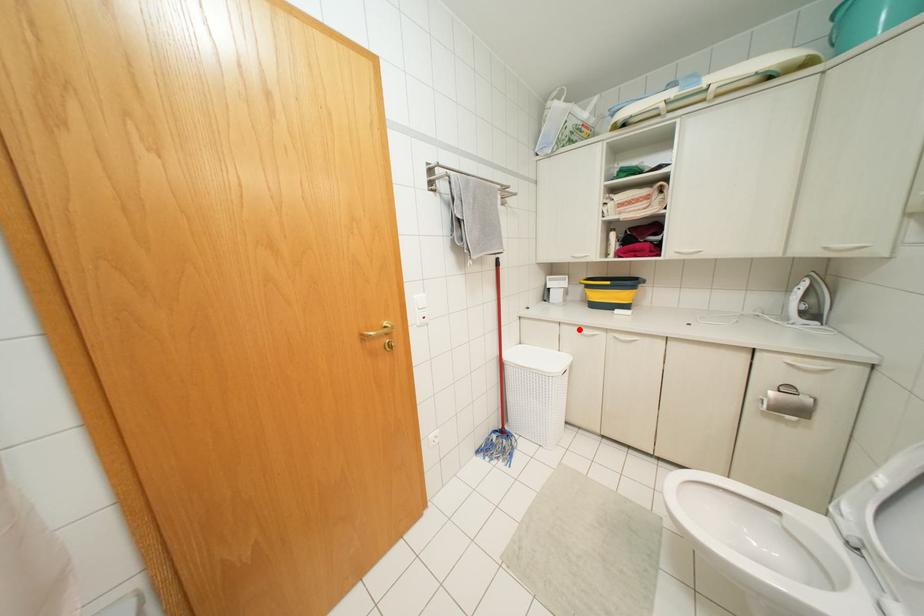
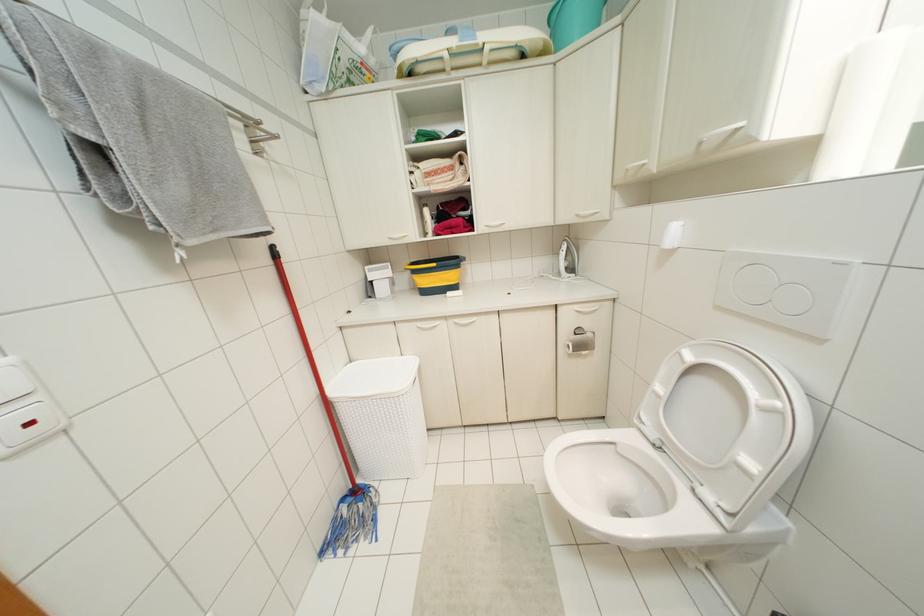
The point at the highlighted location is marked in the first image. Where is the corresponding point in the second image?

(419, 323)